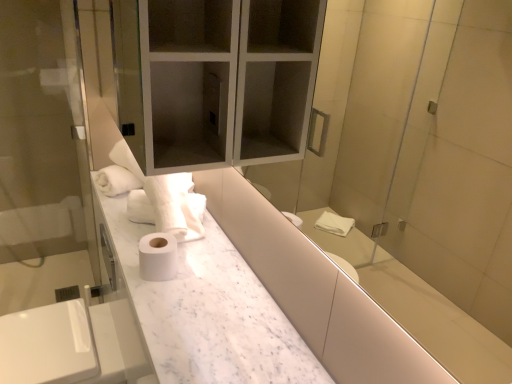
Question: Do you think transparent glass screen door at left is within white marble counter at center, or outside of it?

Choices:
 (A) outside
 (B) inside

Answer: (A)

Question: From the image's perspective, is transparent glass screen door at left positioned above or below white marble counter at center?

Choices:
 (A) above
 (B) below

Answer: (A)

Question: Which object is the closest to the transparent glass screen door at left?

Choices:
 (A) satin nickel faucet at lower left
 (B) white marble counter at center
 (C) transparent glass medicine cabinet at upper center
 (D) white matte toilet paper at center

Answer: (A)

Question: Estimate the real-world distances between objects in this image. Which object is farther from the satin nickel faucet at lower left?

Choices:
 (A) white marble counter at center
 (B) transparent glass screen door at left
 (C) transparent glass medicine cabinet at upper center
 (D) white matte toilet paper at center

Answer: (C)